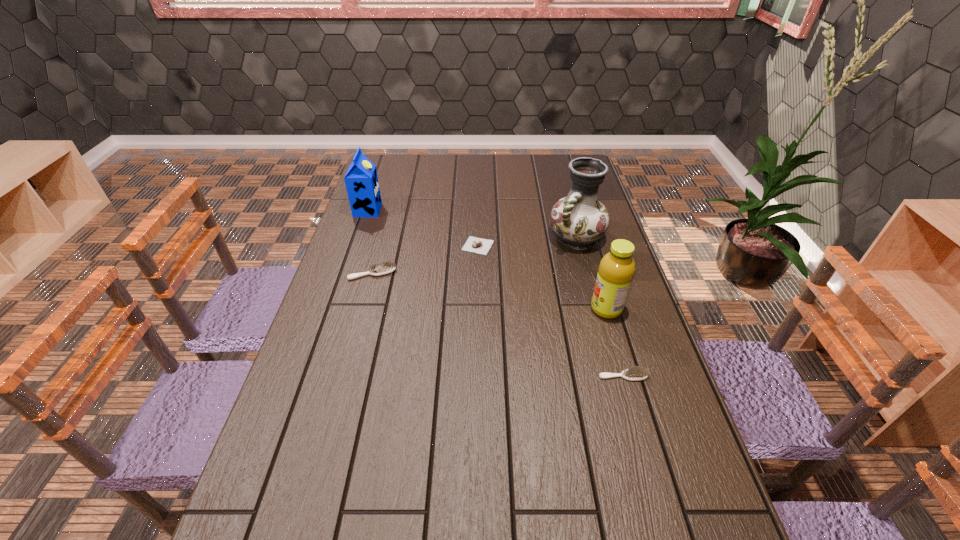
This screenshot has height=540, width=960. I want to click on vase that is at the right edge, so click(578, 220).

Find the location of a particular element. The image size is (960, 540). vacant space at the far edge is located at coordinates (473, 154).

In the image, there is a desktop. Where is `vacant space at the near edge`? vacant space at the near edge is located at coordinates [x=594, y=500].

In the image, there is a desktop. In order to click on vacant space at the left edge in this screenshot , I will do `click(318, 386)`.

Find the location of a particular element. Image resolution: width=960 pixels, height=540 pixels. vacant space at the right edge of the desktop is located at coordinates (603, 251).

In order to click on vacant region at the near left corner of the desktop in this screenshot , I will do `click(279, 520)`.

Where is `free space at the far right corner`? The width and height of the screenshot is (960, 540). free space at the far right corner is located at coordinates (553, 165).

In order to click on free space between the garlic and the vase in this screenshot , I will do `click(527, 242)`.

Locate an element on the screen. The width and height of the screenshot is (960, 540). empty location between the fourth object from right to left and the vase is located at coordinates (527, 242).

You are a GUI agent. You are given a task and a screenshot of the screen. Output one action in this format:
    pyautogui.click(x=<x>, y=<y>)
    Task: Click on the blank region between the garlic and the fifth farthest object
    Image resolution: width=960 pixels, height=540 pixels.
    Given the screenshot: What is the action you would take?
    pyautogui.click(x=542, y=277)